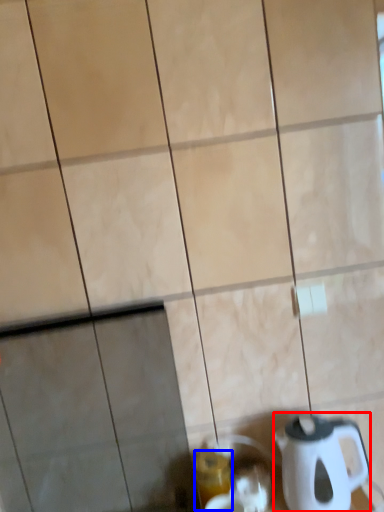
Question: Which of the following is the closest to the observer, kettle (highlighted by a red box) or beverage (highlighted by a blue box)?

Choices:
 (A) kettle
 (B) beverage

Answer: (A)